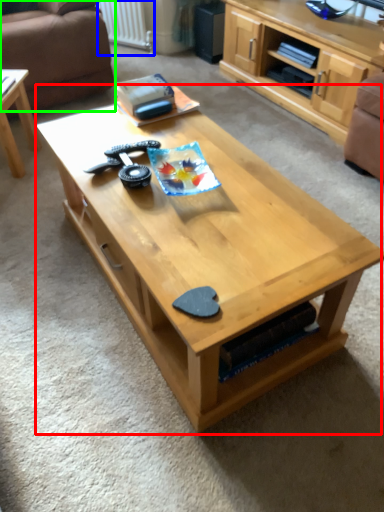
Question: Based on their relative distances, which object is farther from coffee table (highlighted by a red box)? Choose from radiator (highlighted by a blue box) and studio couch (highlighted by a green box).

Choices:
 (A) radiator
 (B) studio couch

Answer: (A)